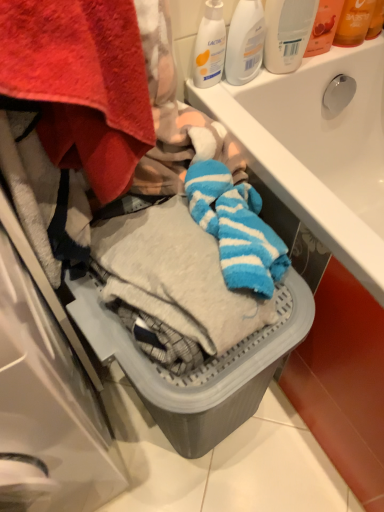
Question: Is translucent plastic bottle at upper right, the 1th toiletry from the left, located within white plastic bottle at upper right, marked as the 1th cleaning product in a right-to-left arrangement?

Choices:
 (A) yes
 (B) no

Answer: (B)

Question: Is white plastic bottle at upper right, placed as the third cleaning product when sorted from left to right, not inside translucent plastic bottle at upper right, the 1th toiletry from the left?

Choices:
 (A) yes
 (B) no

Answer: (A)

Question: Is white plastic bottle at upper right, marked as the 1th cleaning product in a right-to-left arrangement, positioned in front of translucent plastic bottle at upper right, the 2th toiletry in the right-to-left sequence?

Choices:
 (A) no
 (B) yes

Answer: (B)

Question: Considering the relative positions of white plastic bottle at upper right, marked as the 1th cleaning product in a right-to-left arrangement, and translucent plastic bottle at upper right, the 1th toiletry from the left, in the image provided, is white plastic bottle at upper right, marked as the 1th cleaning product in a right-to-left arrangement, to the left of translucent plastic bottle at upper right, the 1th toiletry from the left, from the viewer's perspective?

Choices:
 (A) no
 (B) yes

Answer: (B)

Question: Is white plastic bottle at upper right, marked as the 1th cleaning product in a right-to-left arrangement, thinner than translucent plastic bottle at upper right, the 1th toiletry from the left?

Choices:
 (A) no
 (B) yes

Answer: (A)

Question: From a real-world perspective, is white matte lotion at upper right, placed as the 3th cleaning product when sorted from right to left, above or below translucent orange lotion at upper right, which is the 1th toiletry in right-to-left order?

Choices:
 (A) above
 (B) below

Answer: (B)

Question: Is white matte lotion at upper right, placed as the 3th cleaning product when sorted from right to left, situated inside translucent orange lotion at upper right, the 2th toiletry in the left-to-right sequence, or outside?

Choices:
 (A) inside
 (B) outside

Answer: (B)

Question: Visually, is white matte lotion at upper right, placed as the 3th cleaning product when sorted from right to left, positioned to the left or to the right of translucent orange lotion at upper right, which is the 1th toiletry in right-to-left order?

Choices:
 (A) right
 (B) left

Answer: (B)

Question: Is white matte lotion at upper right, placed as the 3th cleaning product when sorted from right to left, taller or shorter than translucent orange lotion at upper right, which is the 1th toiletry in right-to-left order?

Choices:
 (A) tall
 (B) short

Answer: (B)

Question: Considering the relative positions of translucent plastic bottle at upper right, the 2th toiletry in the right-to-left sequence, and white glossy sink at upper center in the image provided, is translucent plastic bottle at upper right, the 2th toiletry in the right-to-left sequence, to the left or to the right of white glossy sink at upper center?

Choices:
 (A) left
 (B) right

Answer: (A)

Question: From their relative heights in the image, would you say translucent plastic bottle at upper right, the 1th toiletry from the left, is taller or shorter than white glossy sink at upper center?

Choices:
 (A) tall
 (B) short

Answer: (B)

Question: From the image's perspective, is translucent plastic bottle at upper right, the 2th toiletry in the right-to-left sequence, positioned above or below white glossy sink at upper center?

Choices:
 (A) below
 (B) above

Answer: (B)

Question: Considering their positions, is translucent plastic bottle at upper right, the 1th toiletry from the left, located in front of or behind white glossy sink at upper center?

Choices:
 (A) front
 (B) behind

Answer: (B)

Question: From their relative heights in the image, would you say white plastic bottle at upper right, placed as the third cleaning product when sorted from left to right, is taller or shorter than white matte lotion at upper right, placed as the 3th cleaning product when sorted from right to left?

Choices:
 (A) short
 (B) tall

Answer: (B)

Question: Is white plastic bottle at upper right, placed as the third cleaning product when sorted from left to right, in front of or behind white matte lotion at upper right, placed as the 3th cleaning product when sorted from right to left, in the image?

Choices:
 (A) front
 (B) behind

Answer: (A)